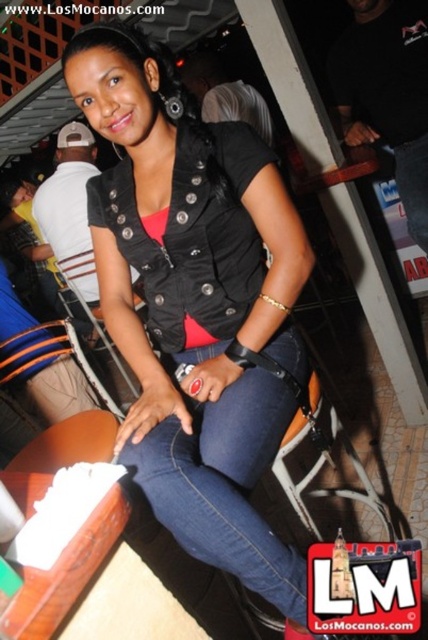
You are a photographer positioned at the front of the scene. You want to take a closeup shot of the black matte vest at center without the metallic silver chair at lower center appearing in the frame. Is this possible based on their positions?

The black matte vest at center is closer to the viewer than the metallic silver chair at lower center, so yes, you can take a closeup shot of the black matte vest at center without the metallic silver chair at lower center appearing in the frame by focusing on the closer object.

You are designing a seating arrangement for a small event and need to choose between two metallic silver chairs. Based on the image, which metallic silver chair between the metallic silver chair at lower center and the metallic silver chair at center would be more suitable for someone who prefers a wider seat?

The metallic silver chair at center is wider than the metallic silver chair at lower center, making it more suitable for someone who prefers a wider seat.